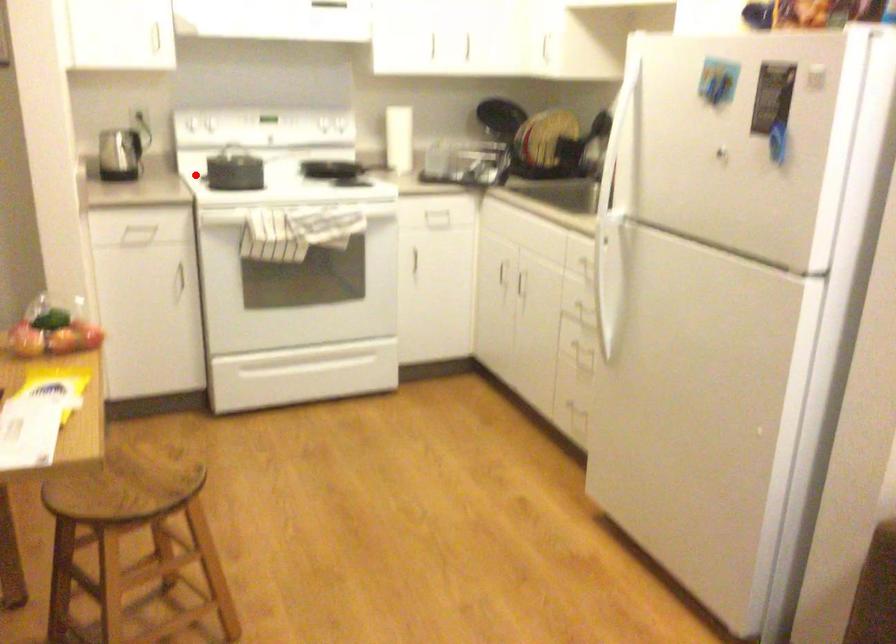
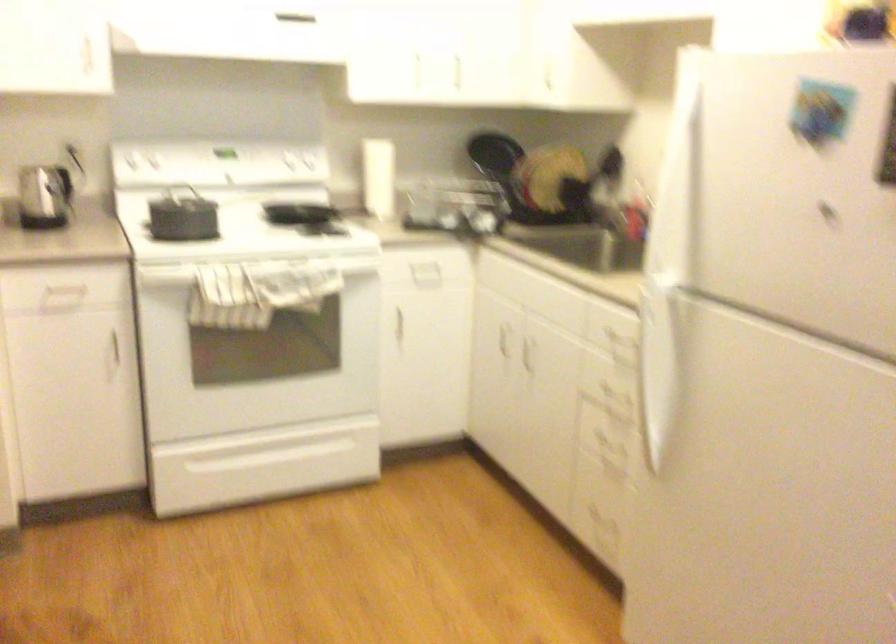
Locate, in the second image, the point that corresponds to the highlighted location in the first image.

(141, 225)